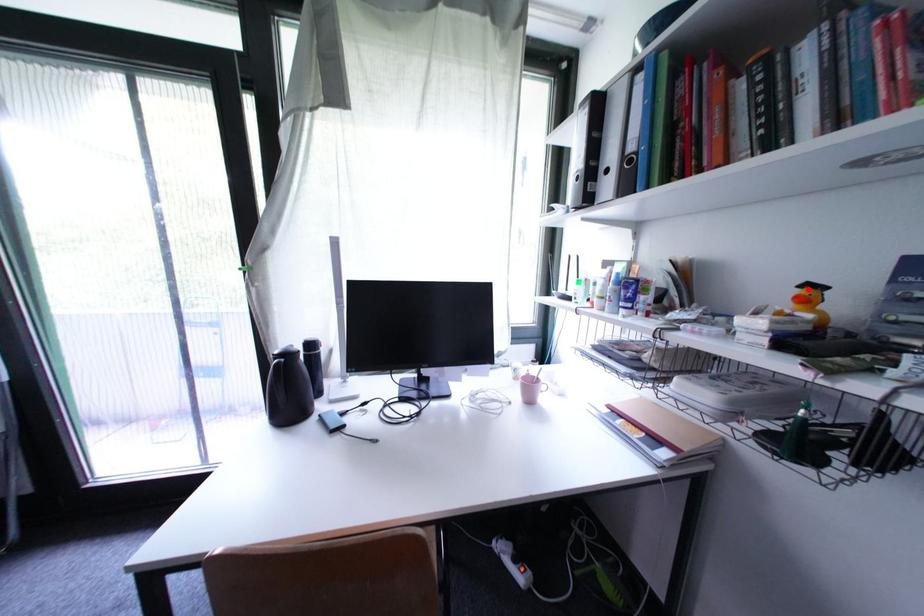
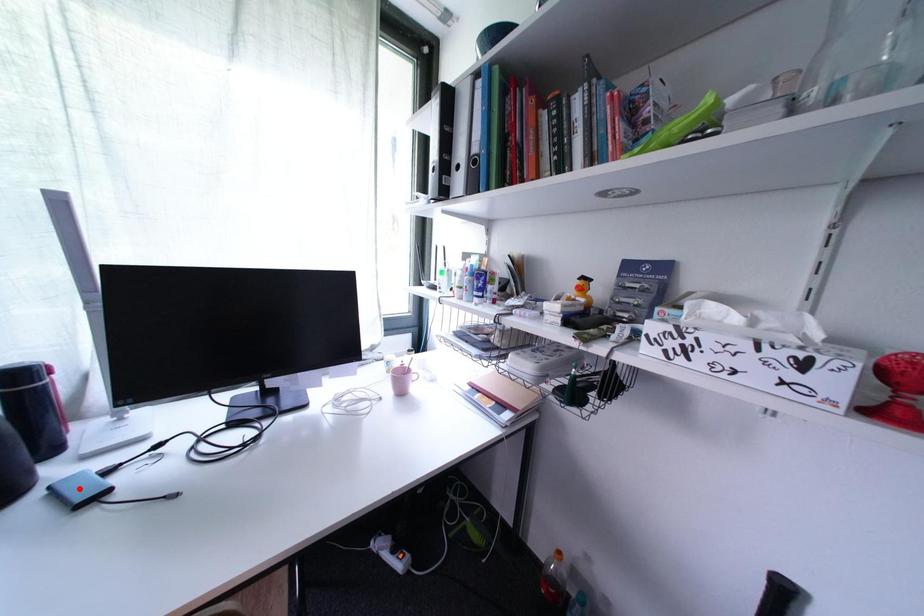
Consider the image. I am providing you with two images of the same scene from different viewpoints. A red point is marked on the first image and another point is marked on the second image. Is the red point in image1 aligned with the point shown in image2?

No